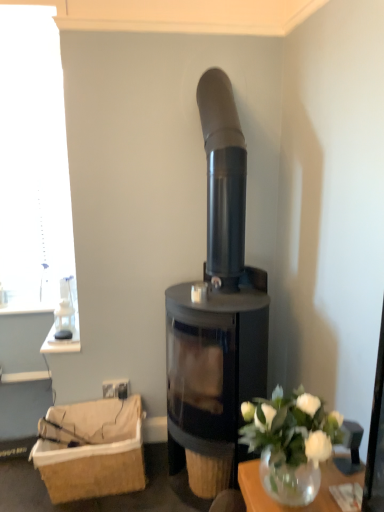
Question: Considering the relative sizes of brown woven basket at lower left and white glass vase at lower right in the image provided, is brown woven basket at lower left taller than white glass vase at lower right?

Choices:
 (A) no
 (B) yes

Answer: (B)

Question: Can you confirm if brown woven basket at lower left is thinner than white glass vase at lower right?

Choices:
 (A) yes
 (B) no

Answer: (B)

Question: Would you say brown woven basket at lower left is outside white glass vase at lower right?

Choices:
 (A) yes
 (B) no

Answer: (A)

Question: Can you confirm if brown woven basket at lower left is positioned to the left of white glass vase at lower right?

Choices:
 (A) no
 (B) yes

Answer: (B)

Question: From the image's perspective, would you say brown woven basket at lower left is positioned over white glass vase at lower right?

Choices:
 (A) yes
 (B) no

Answer: (B)

Question: In terms of width, does white glass vase at lower right look wider or thinner when compared to brown woven basket at lower left?

Choices:
 (A) thin
 (B) wide

Answer: (A)

Question: In terms of size, does white glass vase at lower right appear bigger or smaller than brown woven basket at lower left?

Choices:
 (A) small
 (B) big

Answer: (A)

Question: Is white glass vase at lower right inside the boundaries of brown woven basket at lower left, or outside?

Choices:
 (A) inside
 (B) outside

Answer: (B)

Question: Does point (289, 452) appear closer or farther from the camera than point (107, 482)?

Choices:
 (A) farther
 (B) closer

Answer: (B)

Question: From a real-world perspective, is brown woven basket at lower left physically located above or below matte black wood burning stove at center?

Choices:
 (A) above
 (B) below

Answer: (B)

Question: Based on their sizes in the image, would you say brown woven basket at lower left is bigger or smaller than matte black wood burning stove at center?

Choices:
 (A) big
 (B) small

Answer: (B)

Question: Is brown woven basket at lower left in front of or behind matte black wood burning stove at center in the image?

Choices:
 (A) front
 (B) behind

Answer: (B)

Question: Considering the positions of point pyautogui.click(x=127, y=479) and point pyautogui.click(x=180, y=382), is point pyautogui.click(x=127, y=479) closer or farther from the camera than point pyautogui.click(x=180, y=382)?

Choices:
 (A) farther
 (B) closer

Answer: (B)

Question: Is matte black wood burning stove at center wider or thinner than brown woven basket at lower left?

Choices:
 (A) wide
 (B) thin

Answer: (A)

Question: Based on their sizes in the image, would you say matte black wood burning stove at center is bigger or smaller than brown woven basket at lower left?

Choices:
 (A) big
 (B) small

Answer: (A)